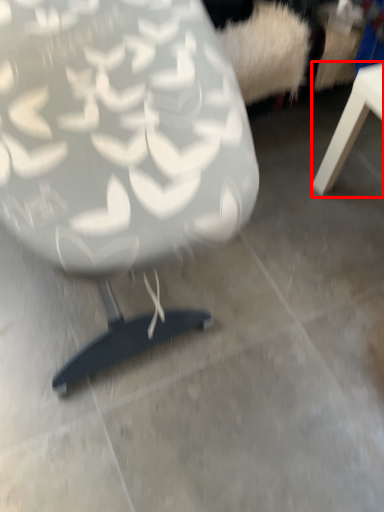
Question: Observing the image, what is the correct spatial positioning of table (annotated by the red box) in reference to chair?

Choices:
 (A) left
 (B) right

Answer: (B)